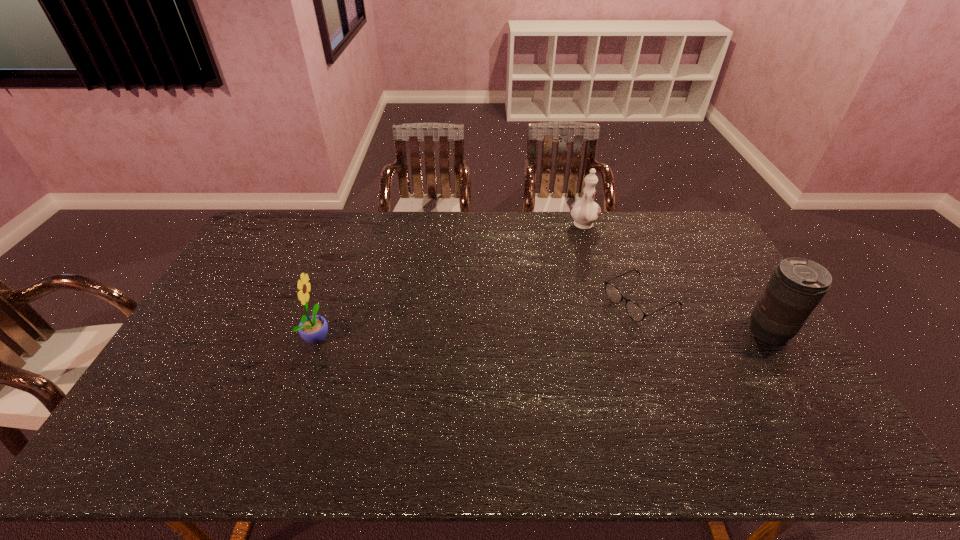
You are a GUI agent. You are given a task and a screenshot of the screen. Output one action in this format:
    pyautogui.click(x=<x>, y=<y>)
    Task: Click on the empty space that is in between the shortest object and the rightmost object
    Image resolution: width=960 pixels, height=540 pixels.
    Given the screenshot: What is the action you would take?
    pyautogui.click(x=705, y=315)

Find the location of a particular element. the second closest object to the sunflower is located at coordinates (585, 212).

Where is `object that ranks as the third closest to the rightmost object`? Image resolution: width=960 pixels, height=540 pixels. object that ranks as the third closest to the rightmost object is located at coordinates click(x=313, y=329).

The image size is (960, 540). What are the coordinates of `vacant area that satisfies the following two spatial constraints: 1. on the front side of the telephoto lens; 2. on the side of the farthest object where the control switches are located` in the screenshot? It's located at (615, 332).

You are a GUI agent. You are given a task and a screenshot of the screen. Output one action in this format:
    pyautogui.click(x=<x>, y=<y>)
    Task: Click on the free region that satisfies the following two spatial constraints: 1. on the front side of the telephoto lens; 2. on the side of the spectacles where the control switches are located
    This screenshot has width=960, height=540.
    Given the screenshot: What is the action you would take?
    pyautogui.click(x=654, y=332)